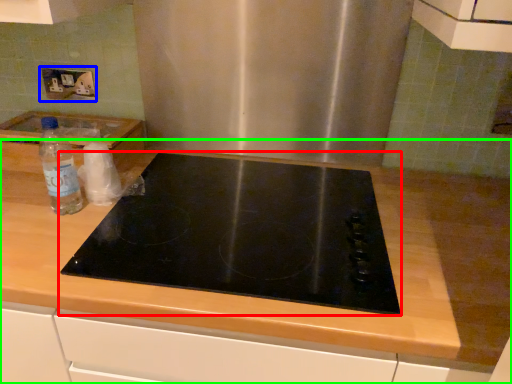
Question: Which object is positioned farthest from gas stove (highlighted by a red box)? Select from electric outlet (highlighted by a blue box) and countertop (highlighted by a green box).

Choices:
 (A) electric outlet
 (B) countertop

Answer: (A)